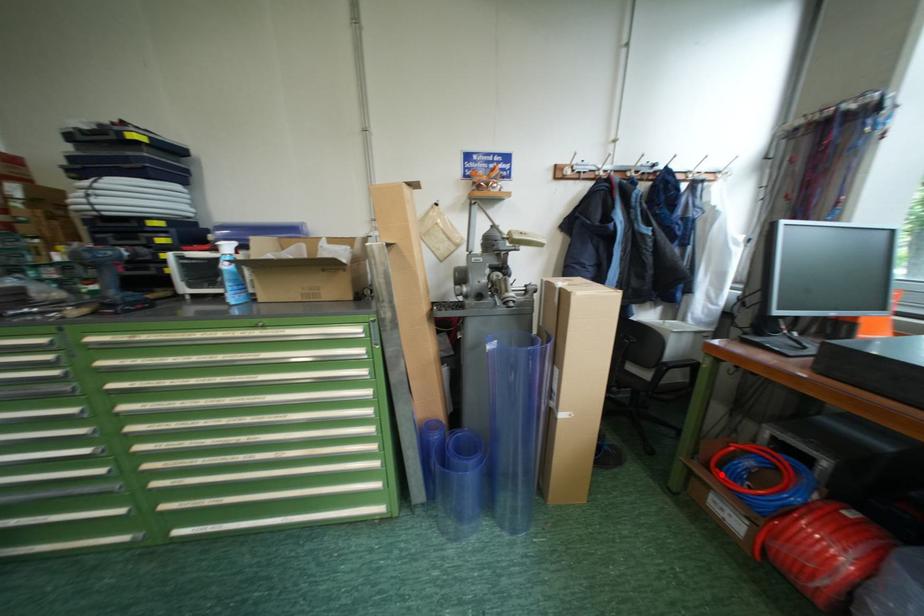
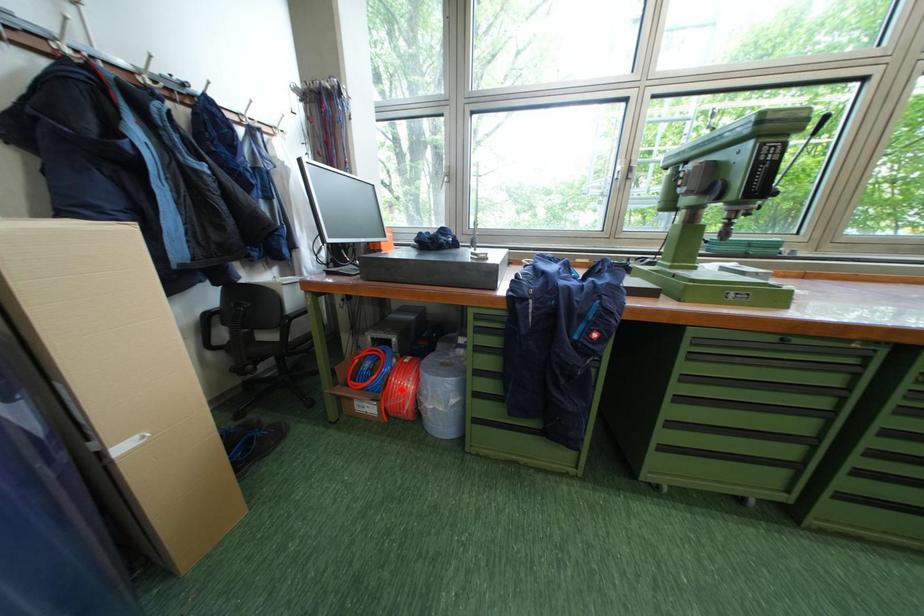
I am providing you with two images of the same scene from different viewpoints. A red point is marked on the first image and another point is marked on the second image. Does the point marked in image1 correspond to the same location as the one in image2?

No